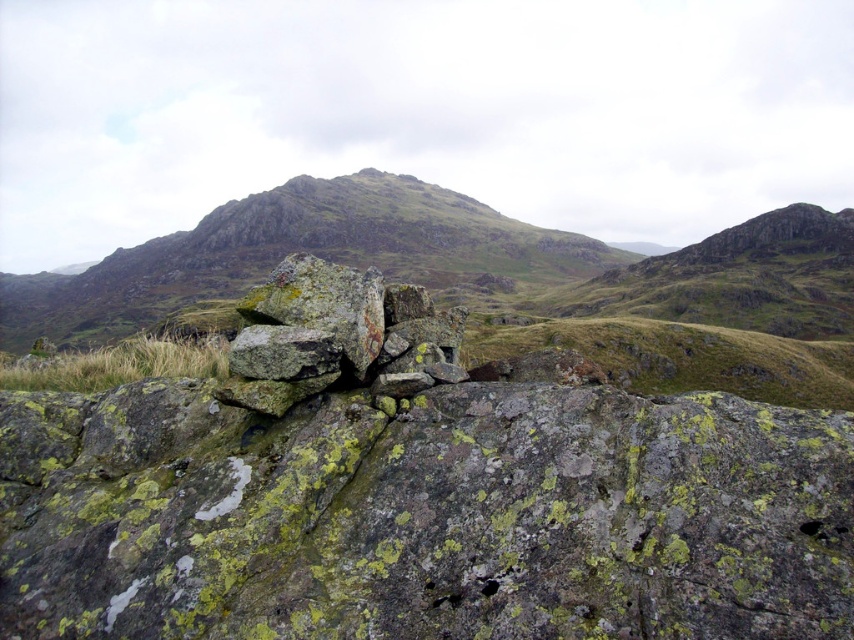
Who is positioned more to the right, rusty metallic pile at center or rusty stone boulders at center?

Positioned to the right is rusty metallic pile at center.

Which of these two, rusty metallic pile at center or rusty stone boulders at center, stands shorter?

With less height is rusty metallic pile at center.

Describe the element at coordinates (414, 492) in the screenshot. I see `rusty metallic pile at center` at that location.

Locate an element on the screen. The width and height of the screenshot is (854, 640). rusty metallic pile at center is located at coordinates (414, 492).